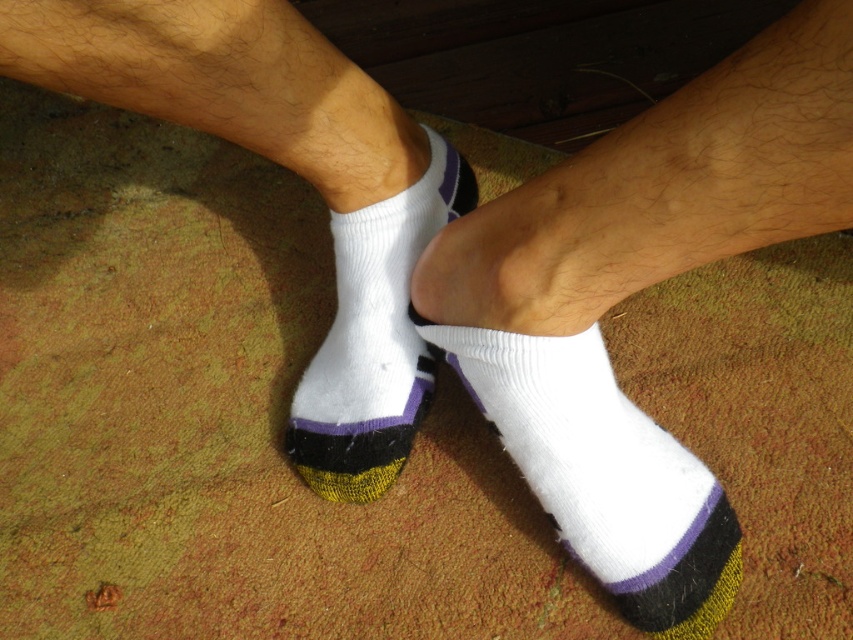
Question: Is white knit sock at center thinner than white knitted sock at center?

Choices:
 (A) no
 (B) yes

Answer: (A)

Question: Which of the following is the closest to the observer?

Choices:
 (A) (343, 412)
 (B) (505, 433)
 (C) (711, 192)
 (D) (280, 29)

Answer: (C)

Question: Can you confirm if white fabric sock at center is positioned to the right of white knit sock at center?

Choices:
 (A) no
 (B) yes

Answer: (B)

Question: Can you confirm if white knitted socks at center is smaller than white knit sock at center?

Choices:
 (A) no
 (B) yes

Answer: (A)

Question: Which point appears farthest from the camera in this image?

Choices:
 (A) (334, 92)
 (B) (714, 504)
 (C) (331, 445)

Answer: (C)

Question: Which of these objects is positioned closest to the white fabric sock at center?

Choices:
 (A) white knit sock at center
 (B) white knitted sock at center

Answer: (A)